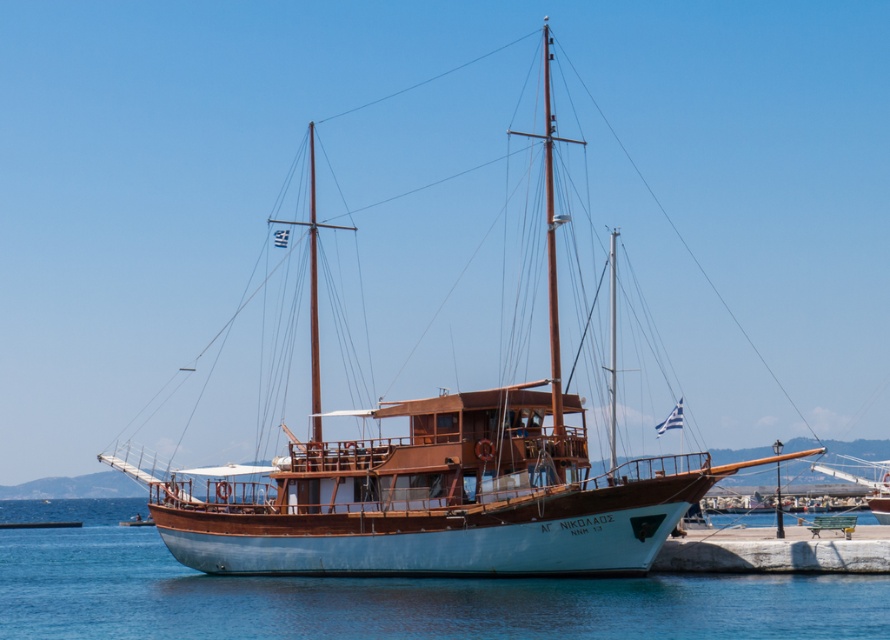
Is point (611, 513) positioned before point (231, 628)?

No, it is not.

In the scene shown: Who is positioned more to the right, white wooden sailboat at center or white smooth water at center?

white wooden sailboat at center

Where is `white wooden sailboat at center`? The image size is (890, 640). white wooden sailboat at center is located at coordinates (435, 477).